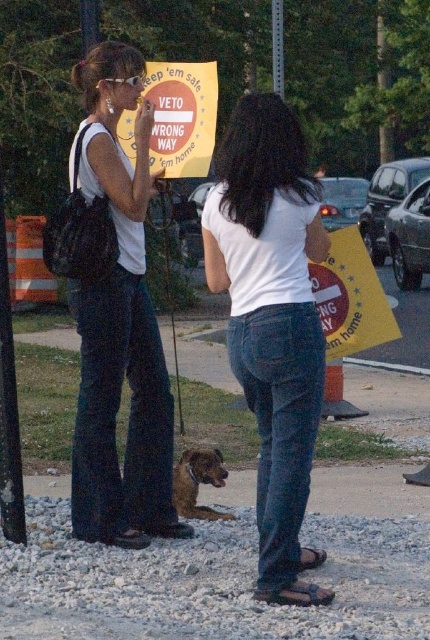
Between point (307, 250) and point (273, 76), which one is positioned in front?

Positioned in front is point (307, 250).

Is white matte shirt at center above brushed metal pole at upper center?

Actually, white matte shirt at center is below brushed metal pole at upper center.

Is point (239, 276) in front of point (272, 13)?

Yes, it is.

The image size is (430, 640). I want to click on white matte shirt at center, so click(272, 321).

Does yellow paper sign at center appear over brushed metal pole at upper center?

No.

Does yellow paper sign at center have a larger size compared to brushed metal pole at upper center?

Yes.

Is point (171, 113) positioned in front of point (273, 76)?

Yes.

Where is `yellow paper sign at center`? The height and width of the screenshot is (640, 430). yellow paper sign at center is located at coordinates [x=181, y=116].

Between white matte shirt at center and matte white tank top at center, which one appears on the right side from the viewer's perspective?

From the viewer's perspective, white matte shirt at center appears more on the right side.

Does point (291, 593) lie behind point (86, 76)?

No, it is in front of (86, 76).

In order to click on white matte shirt at center in this screenshot , I will do `click(272, 321)`.